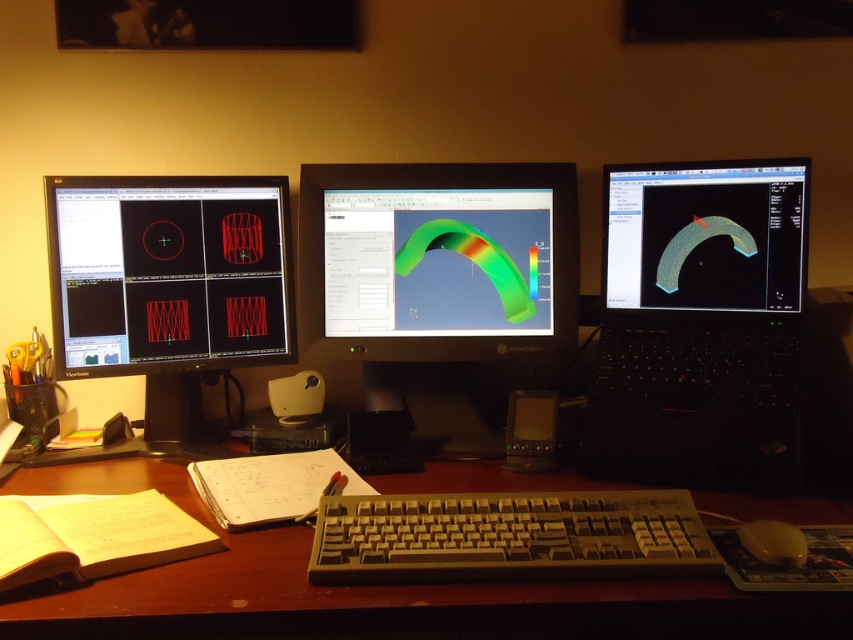
You are a remote worker who needs to place a new wireless charger that requires 10 cm of clearance above it to function properly. You have the black glossy laptop at right and the white plastic mouse at lower right on your desk. Which object would prevent the charger from working if placed directly beneath it?

The black glossy laptop at right has a greater height compared to the white plastic mouse at lower right, so placing the wireless charger directly beneath it would block the required 10 cm clearance, preventing it from functioning properly.

You are working on a project and need to place the white plastic mouse at lower right next to the black glossy laptop at right. Will the mouse fit next to the laptop without overlapping?

The black glossy laptop at right is wider than the white plastic mouse at lower right, so there should be enough space to place the mouse next to it without overlapping.